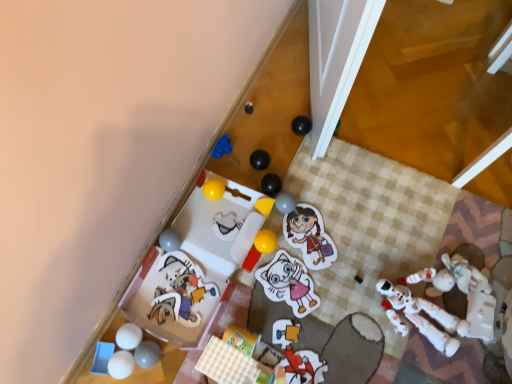
Identify the location of vacant area situated below white plastic toy at lower right, marked as the first toy in a right-to-left arrangement (from a real-world perspective). (413, 306).